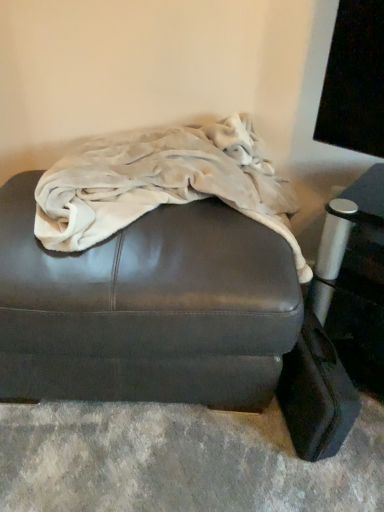
Question: From a real-world perspective, is matte brown leather ottoman at center physically located above or below beige fleece blanket at center?

Choices:
 (A) below
 (B) above

Answer: (A)

Question: Looking at their shapes, would you say matte brown leather ottoman at center is wider or thinner than beige fleece blanket at center?

Choices:
 (A) thin
 (B) wide

Answer: (B)

Question: Considering the real-world distances, which object is closest to the matte brown leather ottoman at center?

Choices:
 (A) beige fleece blanket at center
 (B) black leather suitcase at lower right

Answer: (A)

Question: Considering the real-world distances, which object is farthest from the matte brown leather ottoman at center?

Choices:
 (A) black leather suitcase at lower right
 (B) beige fleece blanket at center

Answer: (A)